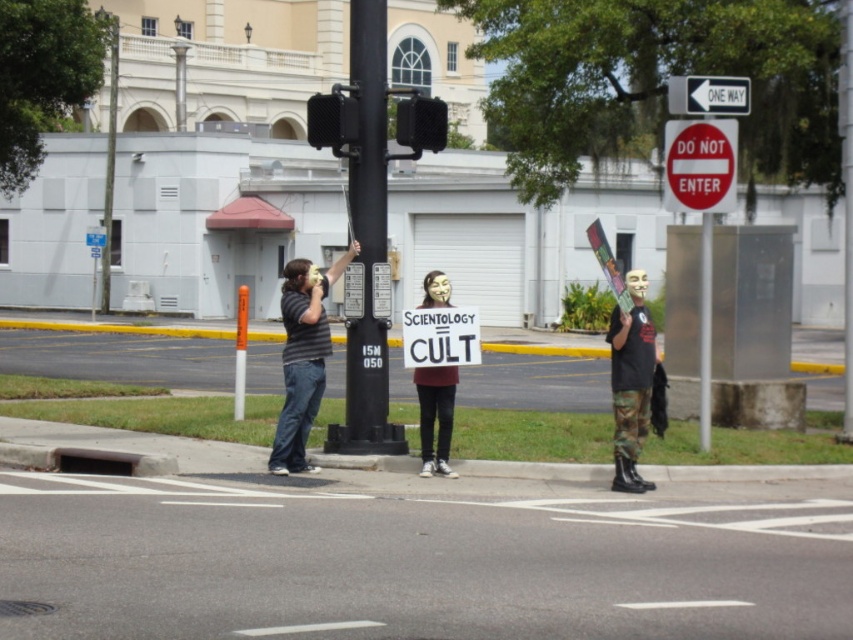
You are a delivery driver navigating through the city and see the image. You need to locate the red matte sign at upper right. Where exactly is it positioned in the image?

The red matte sign at upper right is positioned at the coordinates point (700, 164) in the image.

You are a pedestrian approaching the crosswalk and notice two signs. Which one is larger between the red matte sign at upper right and the white plastic sign at upper center?

The red matte sign at upper right is bigger than the white plastic sign at upper center.

You are a pedestrian standing at the crosswalk and see the striped shirt at center and the matte black sign at center. Which object is taller?

The striped shirt at center is much taller than the matte black sign at center.